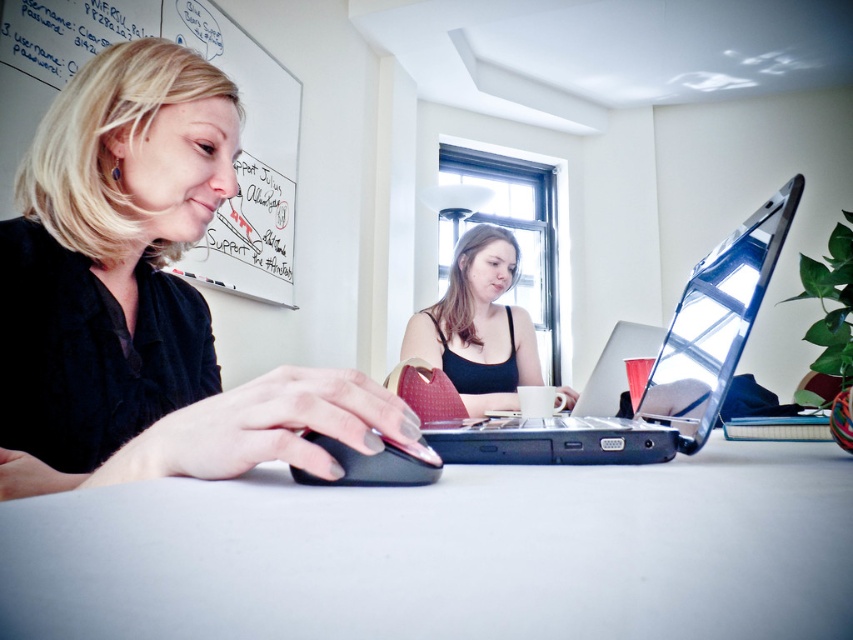
You are organizing a small meeting in the office. You need to place a 12 inch by 12 inch whiteboard on the desk. Can the gray matte table at center accommodate the black plastic laptop at center and the whiteboard without overlapping?

The gray matte table at center might be wider than black plastic laptop at center, so there is a possibility that the table has enough space to fit both the laptop and the whiteboard. However, without exact measurements, it is uncertain. Consider checking the table dimensions before placing the whiteboard.

You are a delivery robot that needs to place a package on the desk between the black matte tank top at center and the black matte mouse at center. The package is 4 feet long. Can you fit the package horizontally between them without overlapping either object?

The distance between the black matte tank top at center and the black matte mouse at center is 4.69 feet. Since the package is 4 feet long, it can fit horizontally between them as the space available is greater than the package length.